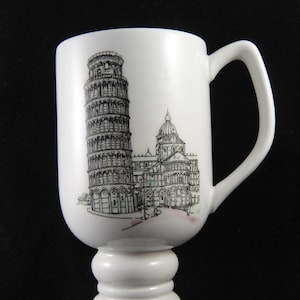
Find the location of a particular element. pedestal is located at coordinates (150, 270).